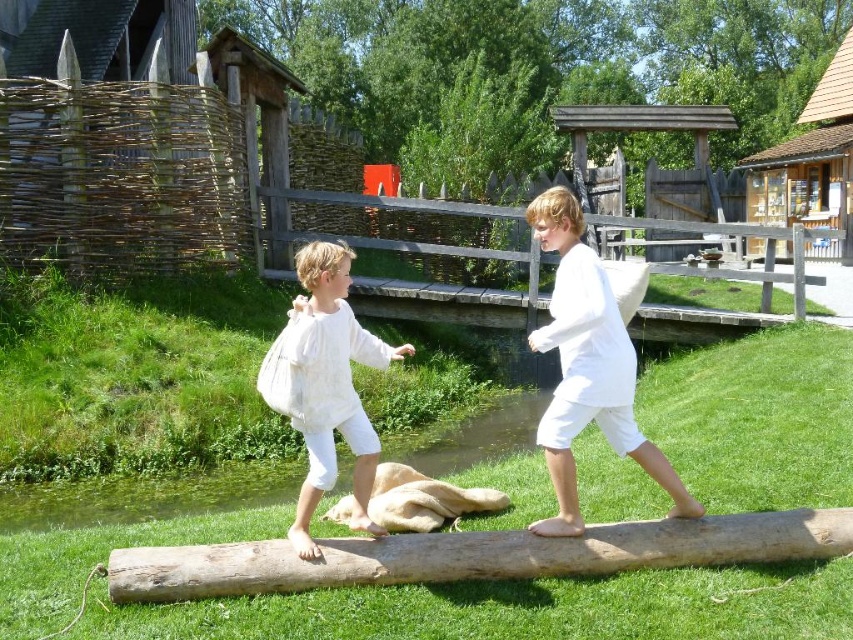
Is brown rough log at center to the left of white fluffy dress at center from the viewer's perspective?

In fact, brown rough log at center is to the right of white fluffy dress at center.

Is brown rough log at center wider than white fluffy dress at center?

Yes.

What do you see at coordinates (474, 556) in the screenshot? I see `brown rough log at center` at bounding box center [474, 556].

Find the location of a particular element. The width and height of the screenshot is (853, 640). brown rough log at center is located at coordinates point(474,556).

Between point (585, 288) and point (453, 456), which one is positioned behind?

Positioned behind is point (453, 456).

Which is more to the left, white cotton shirt at center or green grassy bank at lower center?

green grassy bank at lower center

Locate an element on the screen. white cotton shirt at center is located at coordinates (587, 368).

You are a GUI agent. You are given a task and a screenshot of the screen. Output one action in this format:
    pyautogui.click(x=<x>, y=<y>)
    Task: Click on the white cotton shirt at center
    This screenshot has width=853, height=640.
    Given the screenshot: What is the action you would take?
    coord(587,368)

Who is positioned more to the left, white cotton shirt at center or white fluffy dress at center?

From the viewer's perspective, white fluffy dress at center appears more on the left side.

Between white cotton shirt at center and white fluffy dress at center, which one is positioned higher?

white cotton shirt at center is above.

You are a GUI agent. You are given a task and a screenshot of the screen. Output one action in this format:
    pyautogui.click(x=<x>, y=<y>)
    Task: Click on the white cotton shirt at center
    This screenshot has width=853, height=640.
    Given the screenshot: What is the action you would take?
    pyautogui.click(x=587, y=368)